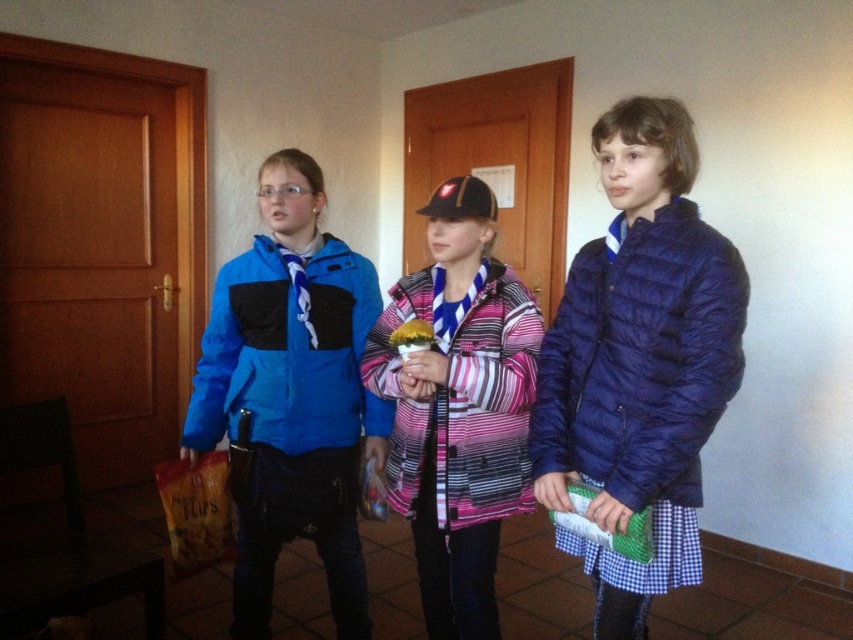
Based on the photo, who is more forward, (424, 595) or (611, 404)?

Point (611, 404) is in front.

Which is more to the left, pink striped jacket at center or matte blue puffer jacket at right?

pink striped jacket at center is more to the left.

Which is behind, point (523, 381) or point (610, 285)?

Point (523, 381)

This screenshot has height=640, width=853. I want to click on pink striped jacket at center, so [457, 406].

Is point (668, 451) farther from viewer compared to point (296, 417)?

No.

Does matte blue puffer jacket at right have a smaller size compared to blue synthetic jacket at left?

Actually, matte blue puffer jacket at right might be larger than blue synthetic jacket at left.

Does point (718, 419) come closer to viewer compared to point (254, 387)?

Yes.

Find the location of a particular element. The image size is (853, 640). matte blue puffer jacket at right is located at coordinates (641, 358).

Which is more to the right, pink striped jacket at center or blue synthetic jacket at left?

Positioned to the right is pink striped jacket at center.

Find the location of a particular element. The width and height of the screenshot is (853, 640). pink striped jacket at center is located at coordinates (457, 406).

Describe the element at coordinates (457, 406) in the screenshot. This screenshot has height=640, width=853. I see `pink striped jacket at center` at that location.

I want to click on pink striped jacket at center, so click(457, 406).